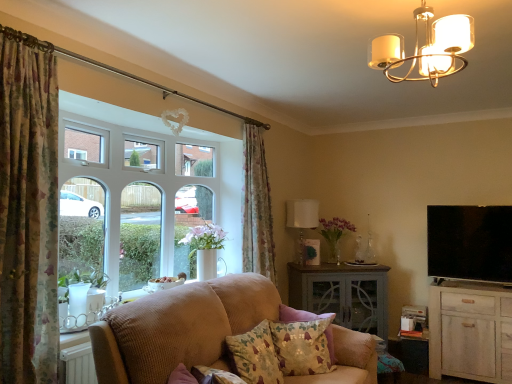
Question: Considering the positions of point (309, 370) and point (197, 150), is point (309, 370) closer or farther from the camera than point (197, 150)?

Choices:
 (A) farther
 (B) closer

Answer: (B)

Question: From a real-world perspective, is floral fabric cushion at lower center, the first pillow positioned from the back, positioned above or below white glass window at left?

Choices:
 (A) above
 (B) below

Answer: (B)

Question: Which is nearer to the floral fabric cushion at lower center, the second pillow from the front?

Choices:
 (A) white glass window at left
 (B) white fabric lampshade at center, the 2th lamp in the top-to-bottom sequence
 (C) white wood cabinet at lower right
 (D) beige fabric couch at lower center
 (E) wooden side table at lower right, the second table from the left

Answer: (D)

Question: Which is nearer to the white wood cabinet at lower right?

Choices:
 (A) white fabric lampshade at center, which is the 1th lamp from bottom to top
 (B) white glass window at left
 (C) floral fabric curtain at upper left, the first curtain viewed from the back
 (D) metallic chandelier at upper center, which appears as the second lamp when viewed from the back
 (E) beige fabric couch at lower center

Answer: (A)